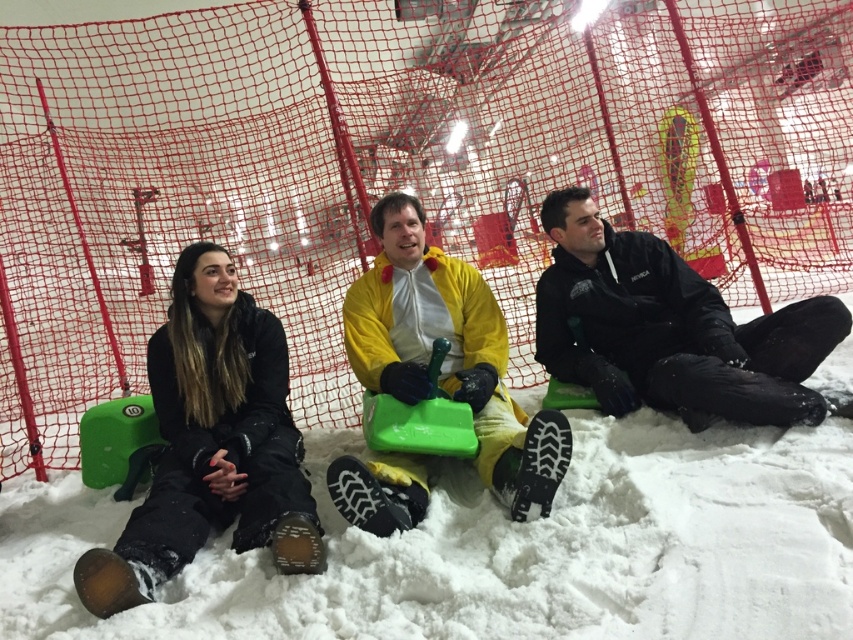
Question: Which object is the farthest from the black matte jacket at center?

Choices:
 (A) yellow matte snowsuit at center
 (B) black matte snow pants at left

Answer: (B)

Question: In this image, where is black matte snow pants at left located relative to black matte jacket at center?

Choices:
 (A) right
 (B) left

Answer: (B)

Question: Which object appears farthest from the camera in this image?

Choices:
 (A) black matte jacket at center
 (B) black matte snow pants at left
 (C) yellow matte snowsuit at center

Answer: (A)

Question: Which object is positioned farthest from the black matte jacket at center?

Choices:
 (A) yellow matte snowsuit at center
 (B) black matte snow pants at left

Answer: (B)

Question: Does black matte snow pants at left lie in front of yellow matte snowsuit at center?

Choices:
 (A) no
 (B) yes

Answer: (B)

Question: Is black matte jacket at center thinner than yellow matte snowsuit at center?

Choices:
 (A) yes
 (B) no

Answer: (B)